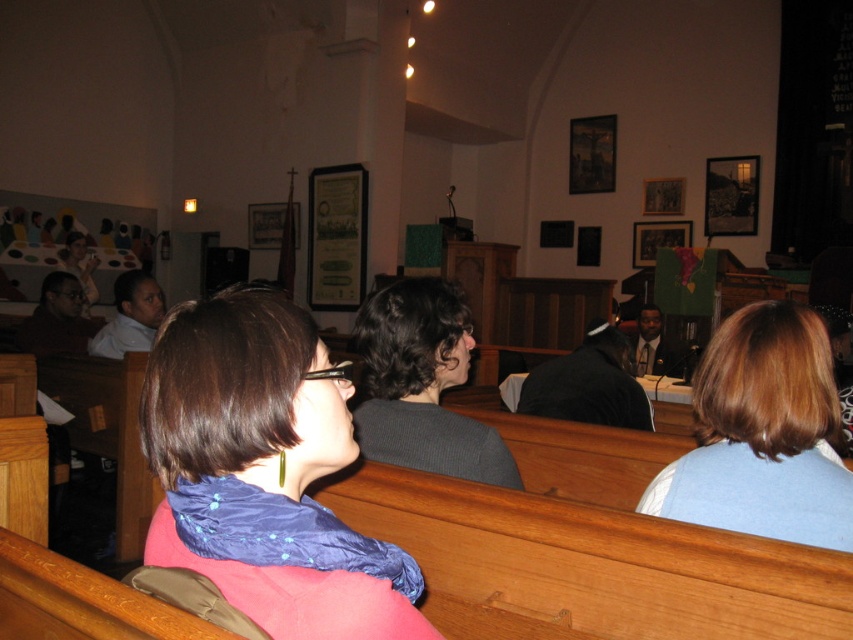
Question: Can you confirm if light brown hair at right is positioned above dark gray sweater at center?

Choices:
 (A) yes
 (B) no

Answer: (B)

Question: Is blue satin scarf at center to the right of matte black laptop at upper left from the viewer's perspective?

Choices:
 (A) no
 (B) yes

Answer: (B)

Question: Which point is closer to the camera?

Choices:
 (A) (404, 422)
 (B) (810, 371)
 (C) (64, 260)

Answer: (B)

Question: Estimate the real-world distances between objects in this image. Which object is closer to the light brown hair at right?

Choices:
 (A) blue satin scarf at center
 (B) dark gray sweater at center
 (C) matte black laptop at upper left

Answer: (B)

Question: Where is blue satin scarf at center located in relation to matte black laptop at upper left in the image?

Choices:
 (A) below
 (B) above

Answer: (A)

Question: Which object is closer to the camera taking this photo?

Choices:
 (A) matte black laptop at upper left
 (B) blue satin scarf at center
 (C) dark gray sweater at center

Answer: (B)